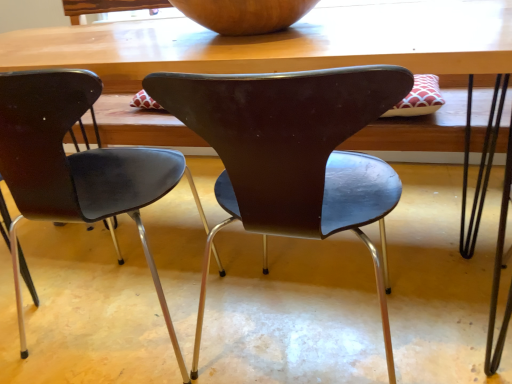
Question: Based on their sizes in the image, would you say wooden table at center is bigger or smaller than wooden bowl at upper center?

Choices:
 (A) big
 (B) small

Answer: (A)

Question: From the image's perspective, is wooden table at center positioned above or below wooden bowl at upper center?

Choices:
 (A) below
 (B) above

Answer: (A)

Question: Estimate the real-world distances between objects in this image. Which object is farther from the matte black chair at center, which is counted as the 1th chair, starting from the left?

Choices:
 (A) wooden bowl at upper center
 (B) brown matte chair at center, the first chair when ordered from right to left
 (C) wooden table at center

Answer: (A)

Question: Which is farther from the wooden table at center?

Choices:
 (A) brown matte chair at center, the second chair viewed from the left
 (B) wooden bowl at upper center
 (C) matte black chair at center, the 2th chair in the right-to-left sequence

Answer: (C)